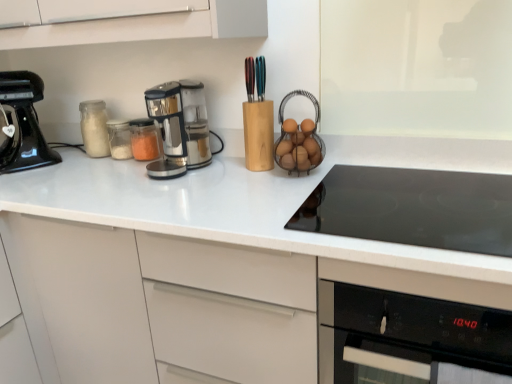
Question: Is translucent glass jar at left wider or thinner than white glossy countertop at center?

Choices:
 (A) wide
 (B) thin

Answer: (B)

Question: Considering their positions, is translucent glass jar at left located in front of or behind white glossy countertop at center?

Choices:
 (A) behind
 (B) front

Answer: (A)

Question: Which is farther from the white glossy countertop at center?

Choices:
 (A) translucent glass jar at left
 (B) black glass oven at lower right
 (C) black glossy stand mixer at left, positioned as the first kitchen appliance in left-to-right order
 (D) sleek metallic coffee maker at center, arranged as the 2th kitchen appliance when viewed from the left
 (E) black glass cooktop at center

Answer: (A)

Question: Which of these objects is positioned closest to the sleek metallic coffee maker at center, arranged as the 2th kitchen appliance when viewed from the left?

Choices:
 (A) black glass oven at lower right
 (B) black glossy stand mixer at left, the second kitchen appliance viewed from the right
 (C) white glossy countertop at center
 (D) translucent glass jar at left
 (E) black glass cooktop at center

Answer: (C)